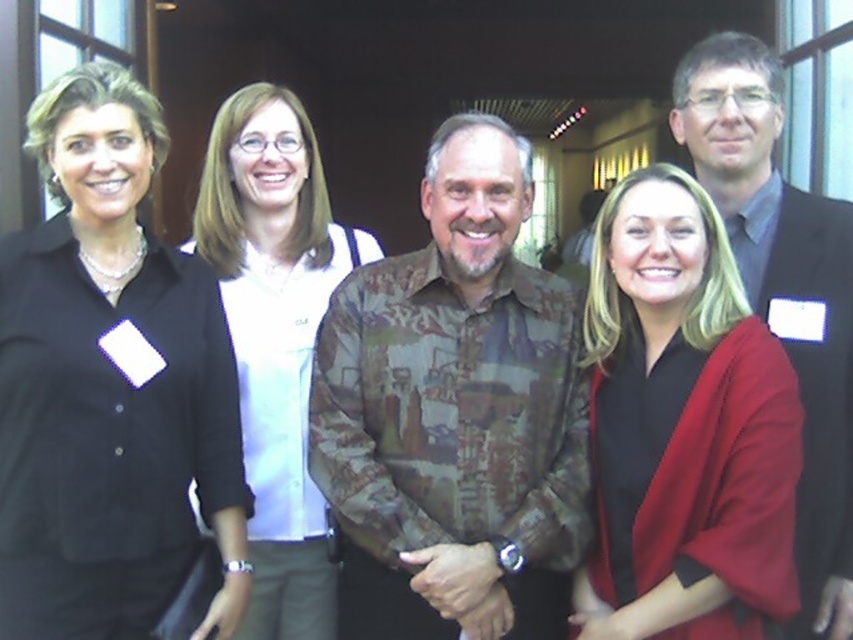
Question: Which is nearer to the black shirt at left?

Choices:
 (A) dark gray suit at right
 (B) matte black blazer at center

Answer: (B)

Question: Which point is farther from the camera taking this photo?

Choices:
 (A) pyautogui.click(x=793, y=294)
 (B) pyautogui.click(x=282, y=532)
 (C) pyautogui.click(x=463, y=452)
 (D) pyautogui.click(x=689, y=266)

Answer: (B)

Question: Estimate the real-world distances between objects in this image. Which object is closer to the matte black blazer at center?

Choices:
 (A) dark gray suit at right
 (B) white matte shirt at center
 (C) black shirt at left
 (D) camouflage shirt at center

Answer: (D)

Question: Where is black shirt at left located in relation to white matte shirt at center in the image?

Choices:
 (A) above
 (B) below

Answer: (A)

Question: Is black shirt at left closer to camera compared to dark gray suit at right?

Choices:
 (A) yes
 (B) no

Answer: (A)

Question: Is camouflage shirt at center closer to the viewer compared to black shirt at left?

Choices:
 (A) yes
 (B) no

Answer: (B)